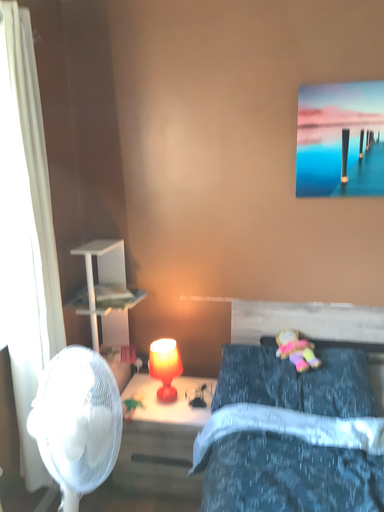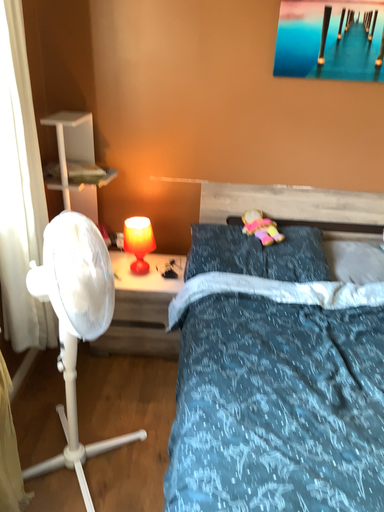
Question: Which way did the camera rotate in the video?

Choices:
 (A) rotated downward
 (B) rotated upward

Answer: (A)